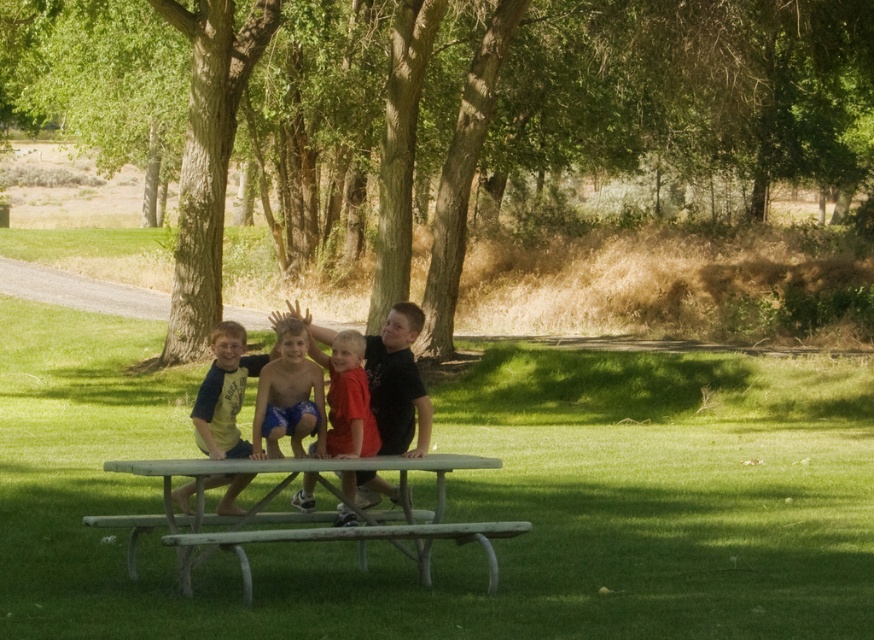
Question: Can you confirm if green leafy tree at center is bigger than yellow matte shirt at center?

Choices:
 (A) yes
 (B) no

Answer: (A)

Question: Which object is the farthest from the blue shorts at center?

Choices:
 (A) matte black shirt at center
 (B) green painted wood picnic table at center
 (C) matte red shirt at center
 (D) wooden bench at center

Answer: (A)

Question: Does green weathered wood bench at center lie in front of blue shorts at center?

Choices:
 (A) no
 (B) yes

Answer: (B)

Question: Which of these objects is positioned farthest from the matte red shirt at center?

Choices:
 (A) yellow matte shirt at center
 (B) green painted wood picnic table at center
 (C) wooden bench at center
 (D) matte black shirt at center

Answer: (D)

Question: Does yellow matte shirt at center appear on the left side of matte red shirt at center?

Choices:
 (A) no
 (B) yes

Answer: (B)

Question: Which object is closer to the camera taking this photo?

Choices:
 (A) green weathered wood bench at center
 (B) yellow matte shirt at center

Answer: (A)